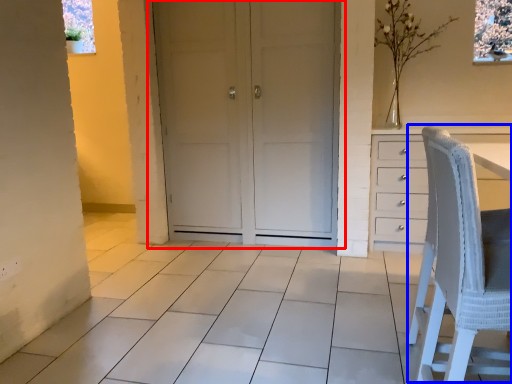
Question: Which point is closer to the camera, door (highlighted by a red box) or rocking chair (highlighted by a blue box)?

Choices:
 (A) door
 (B) rocking chair

Answer: (B)